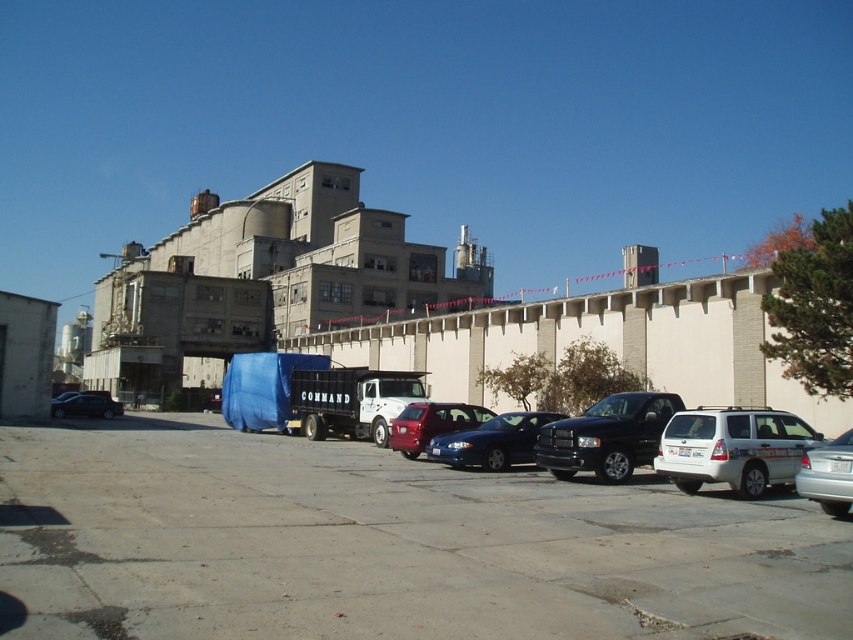
You are a delivery driver who needs to park your 6.5 feet tall truck between the shiny red sedan at center and the shiny black sedan at left. Can your truck fit vertically between them?

The shiny red sedan at center is taller than the shiny black sedan at left. Since your truck is 6.5 feet tall, you need to ensure there is enough vertical clearance between the two sedans. However, the exact height difference isn

In the scene shown: You are a delivery driver who needs to park your truck between the silver metallic sedan at lower right and the shiny black sedan at left. The truck requires 50 meters of space. Is there enough space between them?

The silver metallic sedan at lower right and shiny black sedan at left are 47.21 meters apart, so there isn not enough space to park the truck between them since it requires 50 meters.